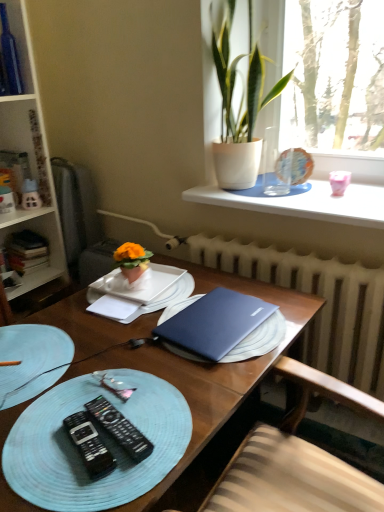
What are the coordinates of `vacant space to the right of black plastic remote control at lower left, which ranks as the second remote control in left-to-right order` in the screenshot? It's located at [x=182, y=418].